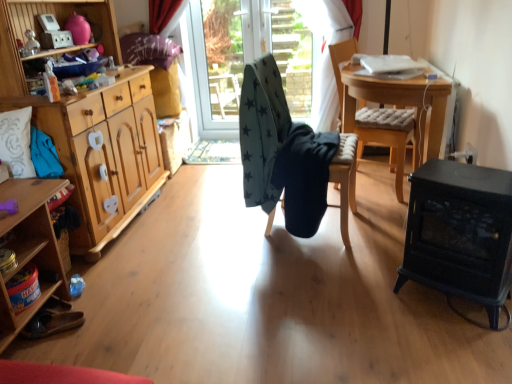
Where is `free space to the back side of brown leather shoes at lower left`? The width and height of the screenshot is (512, 384). free space to the back side of brown leather shoes at lower left is located at coordinates (98, 287).